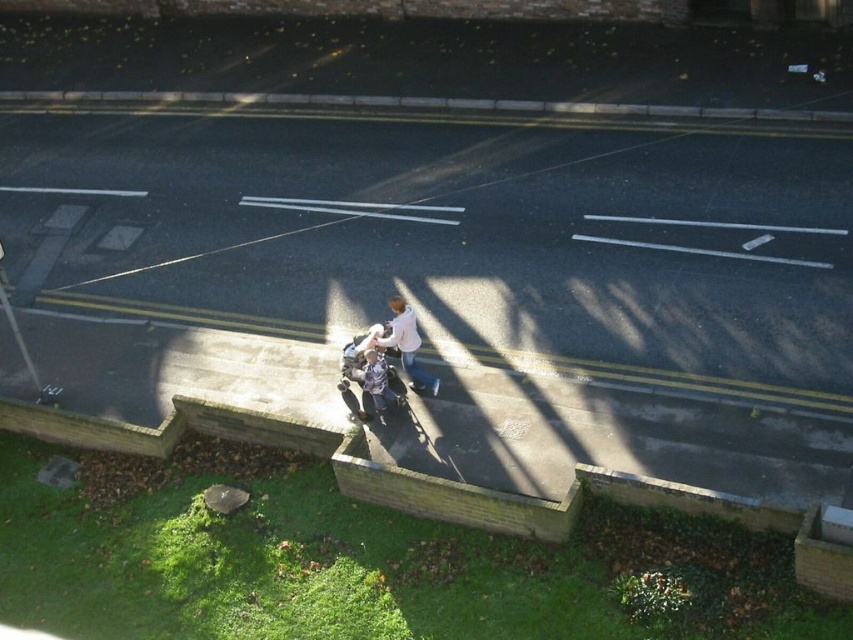
Question: Is white matte shirt at center bigger than blue denim jacket at center?

Choices:
 (A) no
 (B) yes

Answer: (B)

Question: Does white matte shirt at center have a larger size compared to blue denim jacket at center?

Choices:
 (A) yes
 (B) no

Answer: (A)

Question: Which object appears farthest from the camera in this image?

Choices:
 (A) blue denim jacket at center
 (B) white matte shirt at center

Answer: (A)

Question: Can you confirm if white matte shirt at center is bigger than blue denim jacket at center?

Choices:
 (A) yes
 (B) no

Answer: (A)